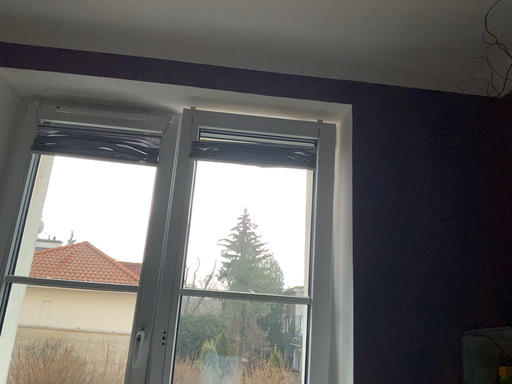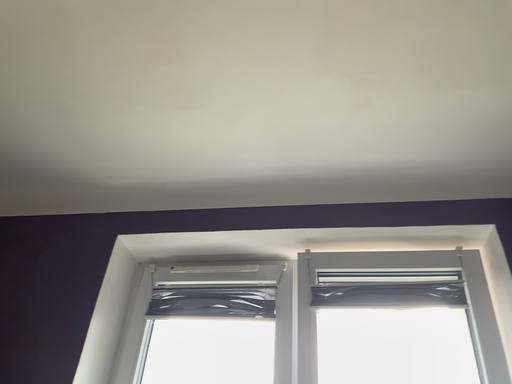
Question: Which way did the camera rotate in the video?

Choices:
 (A) rotated upward
 (B) rotated downward

Answer: (A)